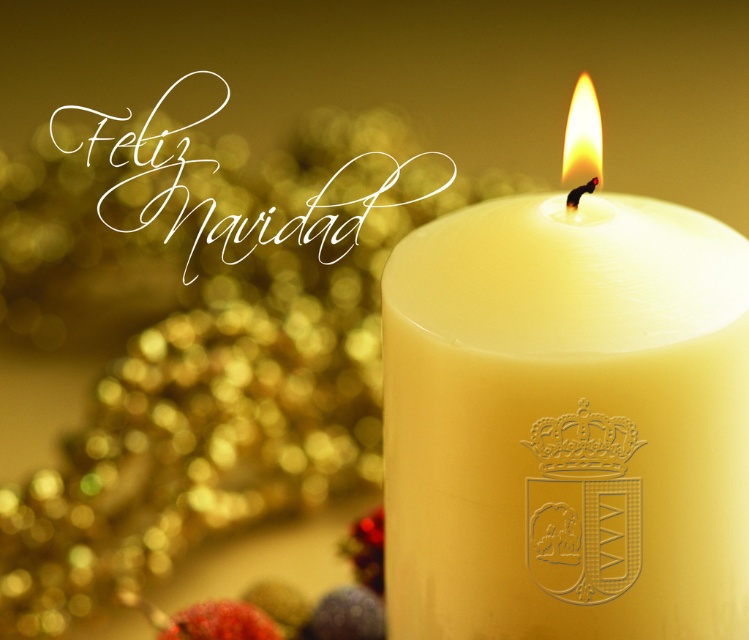
Is white wax candle at center positioned before white wax candle at upper right?

Yes.

Can you confirm if white wax candle at center is positioned above white wax candle at upper right?

No.

Where is `white wax candle at center`? This screenshot has width=749, height=640. white wax candle at center is located at coordinates (565, 422).

You are a GUI agent. You are given a task and a screenshot of the screen. Output one action in this format:
    pyautogui.click(x=<x>, y=<y>)
    Task: Click on the white wax candle at center
    The width and height of the screenshot is (749, 640).
    Given the screenshot: What is the action you would take?
    pyautogui.click(x=565, y=422)